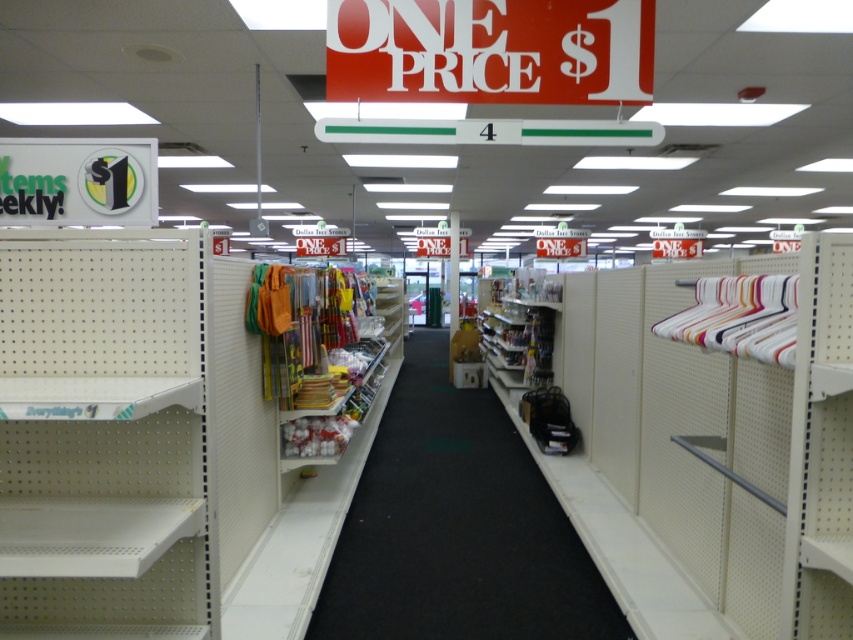
Can you confirm if white matte shelf at right is positioned above white matte shelf at left?

No.

Who is shorter, white matte shelf at right or white matte shelf at left?

With less height is white matte shelf at right.

The image size is (853, 640). In order to click on white matte shelf at right in this screenshot , I will do `click(711, 451)`.

Where is `white matte shelf at right`? white matte shelf at right is located at coordinates (711, 451).

Is white matte shelf at right further to the viewer compared to red plastic sign at upper center?

No, white matte shelf at right is closer to the viewer.

Is point (561, 488) positioned in front of point (566, 8)?

That is False.

The height and width of the screenshot is (640, 853). In order to click on white matte shelf at right in this screenshot , I will do `click(711, 451)`.

Who is positioned more to the right, white matte shelf at left or red plastic sign at upper center?

Positioned to the right is red plastic sign at upper center.

Who is shorter, white matte shelf at left or red plastic sign at upper center?

With less height is red plastic sign at upper center.

Who is more distant from viewer, [90,560] or [370,76]?

Point [370,76]

At what (x,y) coordinates should I click in order to perform the action: click on white matte shelf at left. Please return your answer as a coordinate pair (x, y). Looking at the image, I should click on (103, 435).